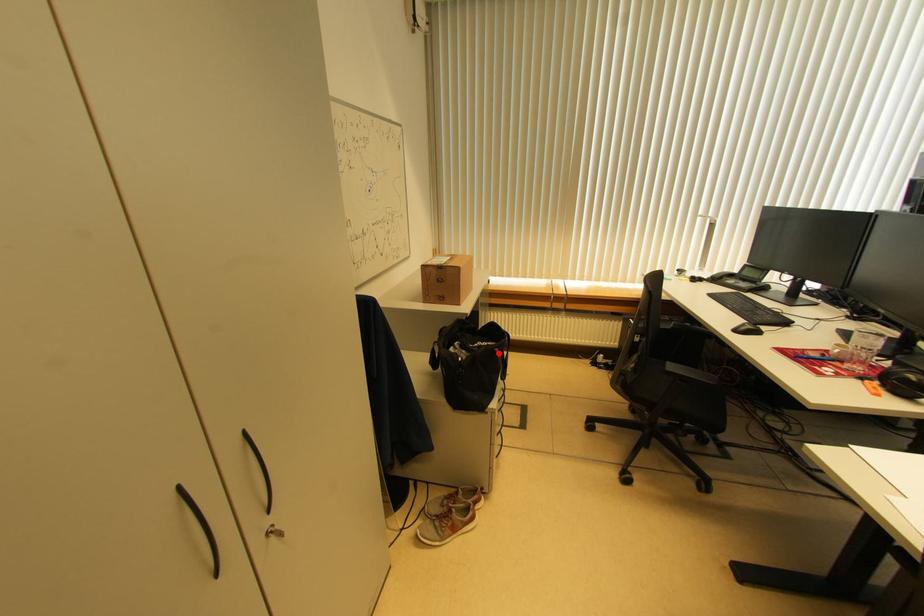
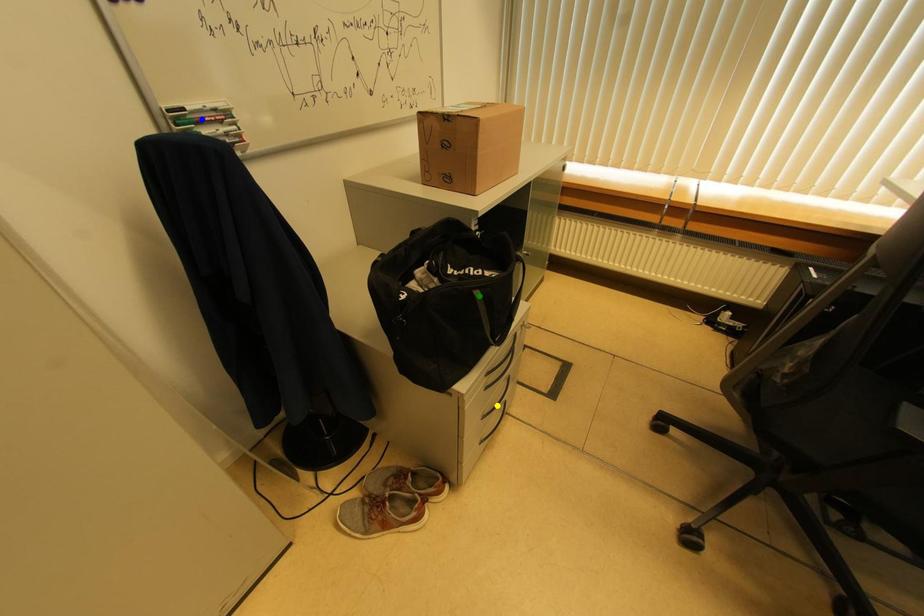
Question: I am providing you with two images of the same scene from different viewpoints. A red point is marked on the first image. You are given multiple points on the second image. Can you choose the point in image 2 that corresponds to the point in image 1?

Choices:
 (A) blue point
 (B) green point
 (C) yellow point

Answer: (B)